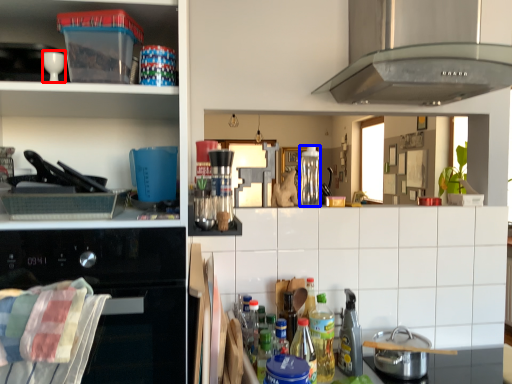
Question: Among these objects, which one is farthest to the camera, appliance (highlighted by a red box) or bottle (highlighted by a blue box)?

Choices:
 (A) appliance
 (B) bottle

Answer: (B)